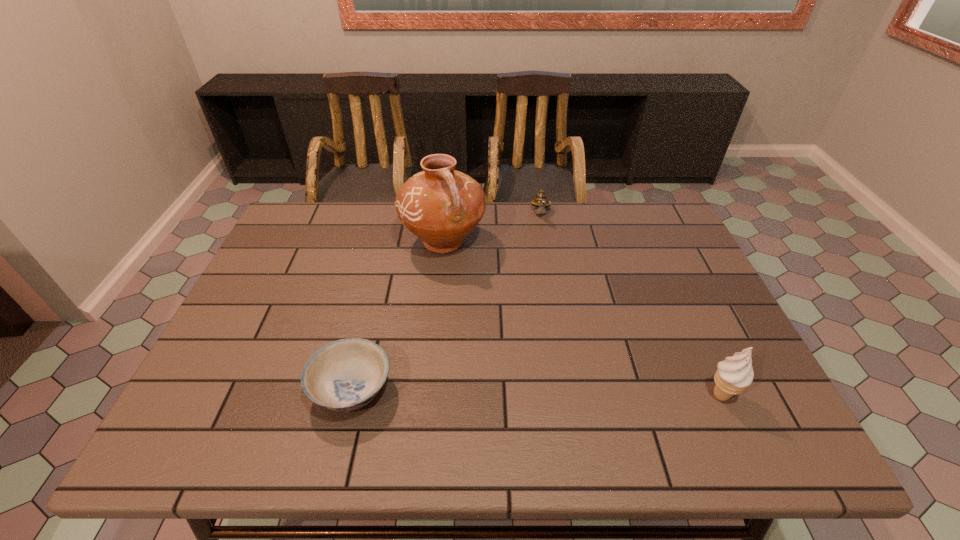
Locate an element on the screen. vacant space on the desktop that is between the shortest object and the icecream and is positioned on the side of the tallest object with the handle is located at coordinates (515, 392).

Locate an element on the screen. Image resolution: width=960 pixels, height=540 pixels. vacant space on the desktop that is between the bowl and the second tallest object and is positioned on the face of the third object from left to right is located at coordinates (549, 393).